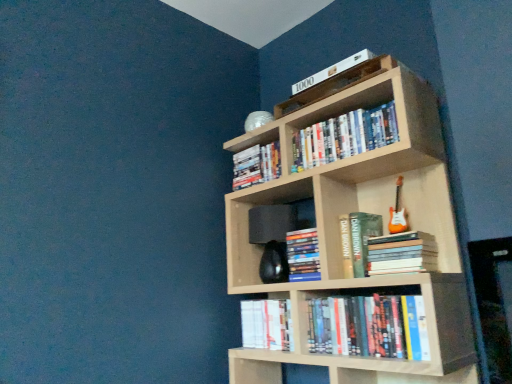
Question: In the image, is white paper book at lower center, the first book in the bottom-to-top sequence, positioned in front of or behind black matte speaker at center?

Choices:
 (A) behind
 (B) front

Answer: (B)

Question: From a real-world perspective, relative to black matte speaker at center, is white paper book at lower center, the first book in the bottom-to-top sequence, vertically above or below?

Choices:
 (A) below
 (B) above

Answer: (A)

Question: Which object is the closest to the white paper book at lower center, the eighth book from the top?

Choices:
 (A) hardcover books at lower center, which appears as the second book when ordered from the bottom
 (B) hardcover book at center, the sixth book positioned from the top
 (C) hardcover book at center, which is the 4th book in top-to-bottom order
 (D) light wood bookcase at upper center
 (E) black matte speaker at center

Answer: (B)

Question: Which object is positioned farthest from the white paper book at lower center, the first book in the bottom-to-top sequence?

Choices:
 (A) hardcover books at upper center, the 2th book from the top
 (B) black matte speaker at center
 (C) white matte book at upper center, the 1th book viewed from the top
 (D) light wood bookcase at upper center
 (E) hardcover book at center, the sixth book positioned from the top

Answer: (C)